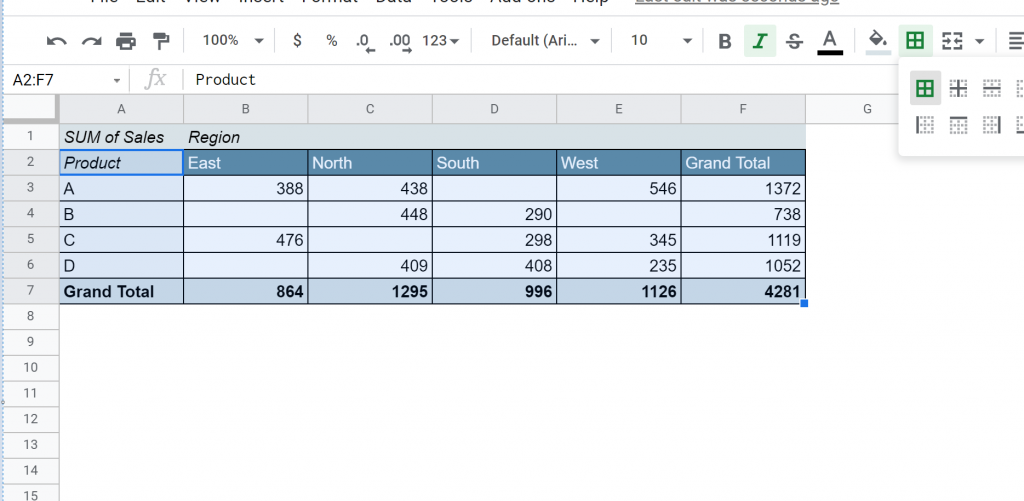
Where is `populated column`? This screenshot has height=501, width=1024. populated column is located at coordinates (128, 161), (259, 154), (364, 162), (495, 163), (628, 163), (763, 165), (26, 111).